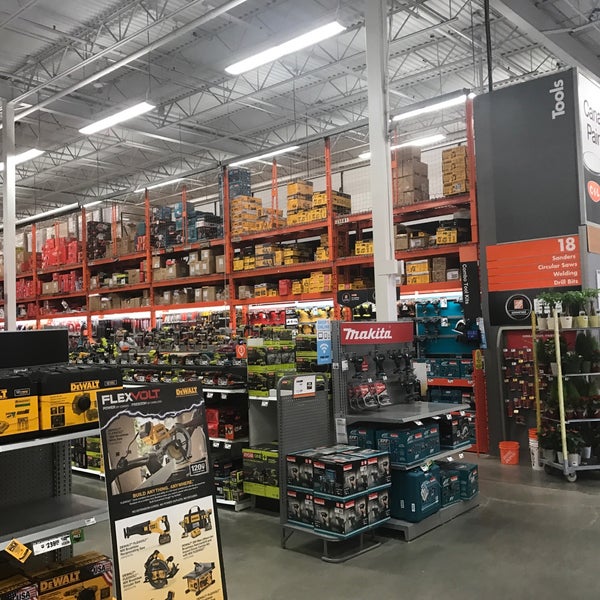
Locate an element on the screen. The width and height of the screenshot is (600, 600). storage shelving is located at coordinates (98, 260), (224, 257), (307, 243), (455, 203), (447, 263), (184, 291), (109, 295).